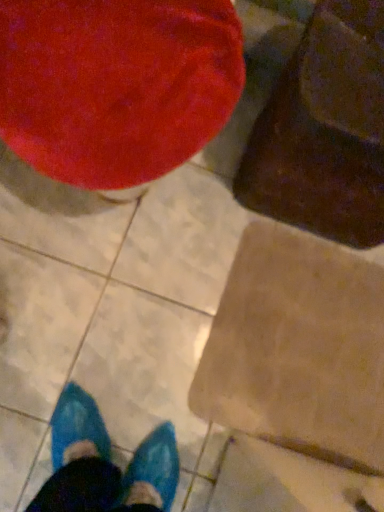
Where is `free spot to the right of velvet red bean bag chair at upper left, the first bean bag chair viewed from the left`? This screenshot has width=384, height=512. free spot to the right of velvet red bean bag chair at upper left, the first bean bag chair viewed from the left is located at coordinates (250, 280).